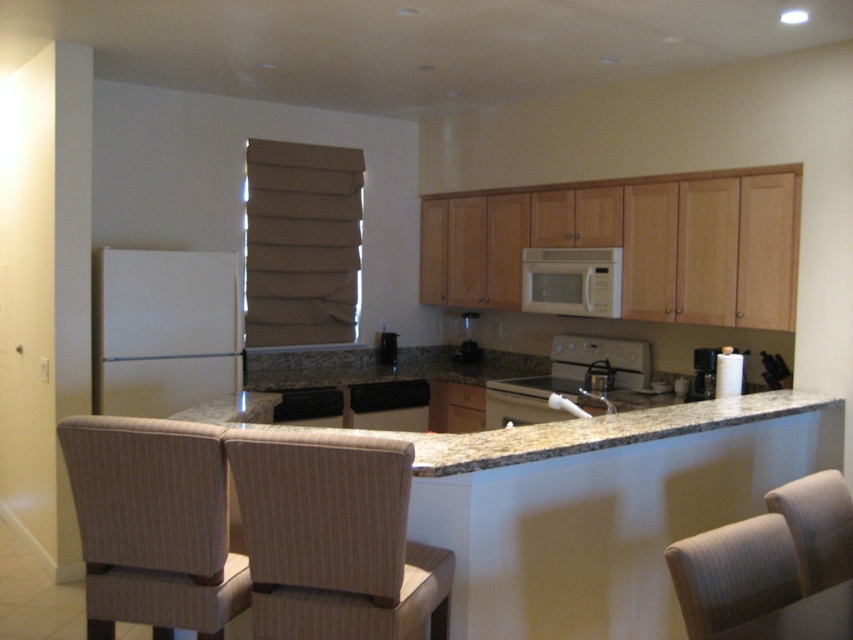
You are standing in the kitchen and want to reach both the point at (833, 568) and the point at (376, 422). Which point will you reach first?

You will reach point (833, 568) first because it is closer to you than point (376, 422).

You are organizing the kitchen and need to place a new appliance that requires 2 meters of width. You have the white matte refrigerator at left and the white glossy kettle at center. Based on their widths, which one can accommodate the appliance?

The white glossy kettle at center has a greater width than the white matte refrigerator at left, so it can accommodate the appliance requiring 2 meters of width.